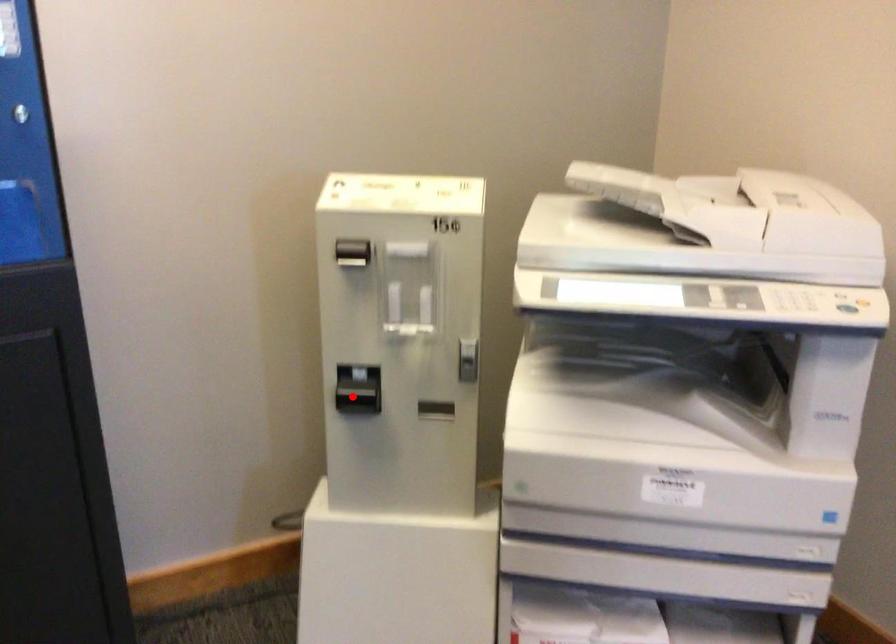
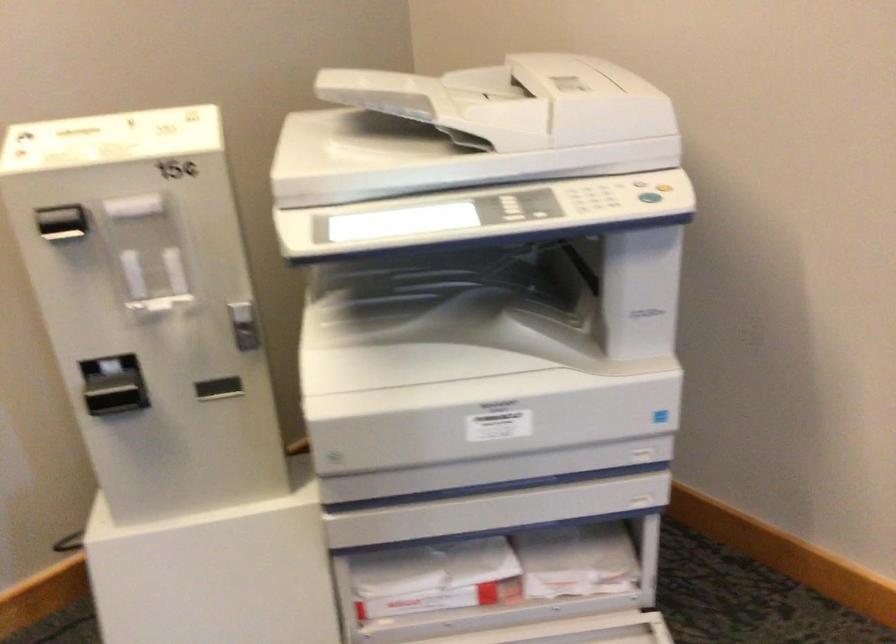
Question: I am providing you with two images of the same scene from different viewpoints. In image1, a red point is highlighted. Considering the same 3D point in image2, which of the following is correct?

Choices:
 (A) It is closer
 (B) It is farther

Answer: (A)